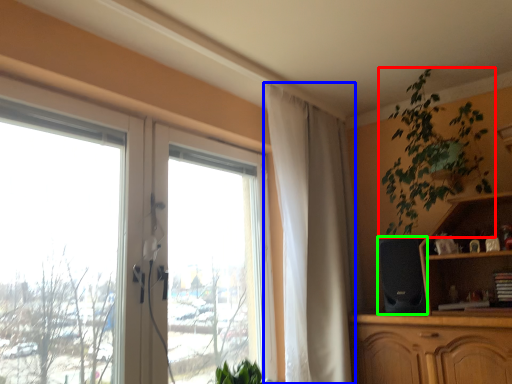
Question: Estimate the real-world distances between objects in this image. Which object is farther from houseplant (highlighted by a red box), curtain (highlighted by a blue box) or speaker (highlighted by a green box)?

Choices:
 (A) curtain
 (B) speaker

Answer: (A)